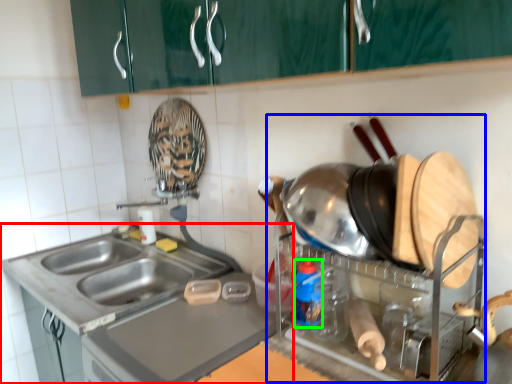
Question: Estimate the real-world distances between objects in this image. Which object is closer to countertop (highlighted by a red box), appliance (highlighted by a blue box) or bottle (highlighted by a green box)?

Choices:
 (A) appliance
 (B) bottle

Answer: (A)